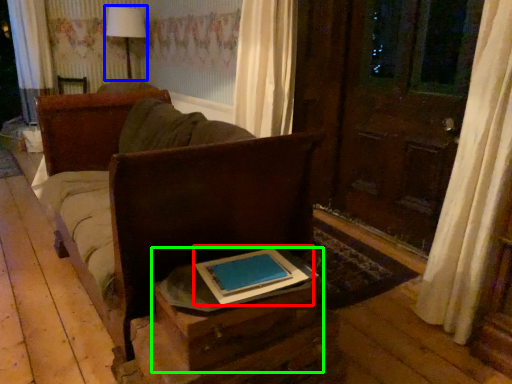
Question: Based on their relative distances, which object is farther from book (highlighted by a red box)? Choose from table lamp (highlighted by a blue box) and table (highlighted by a green box).

Choices:
 (A) table lamp
 (B) table

Answer: (A)